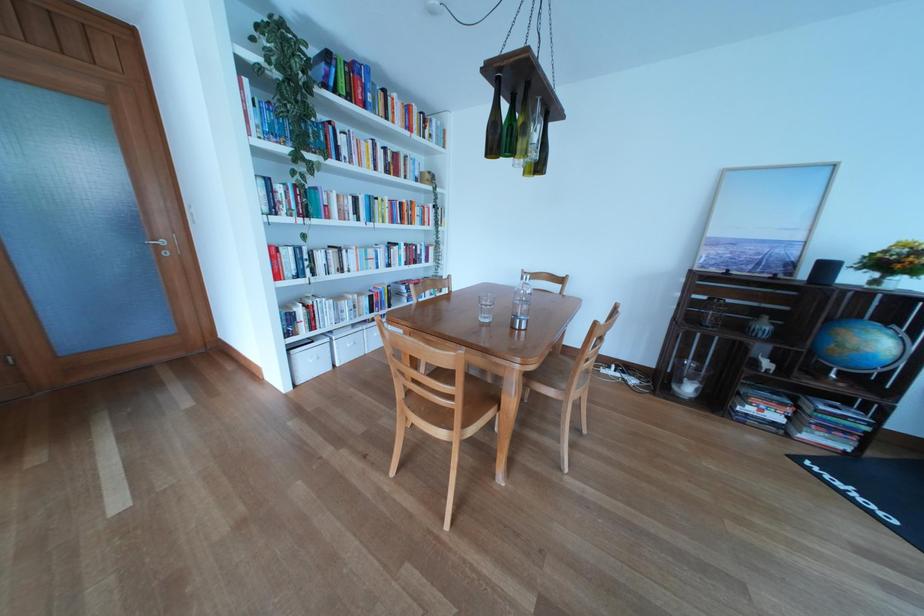
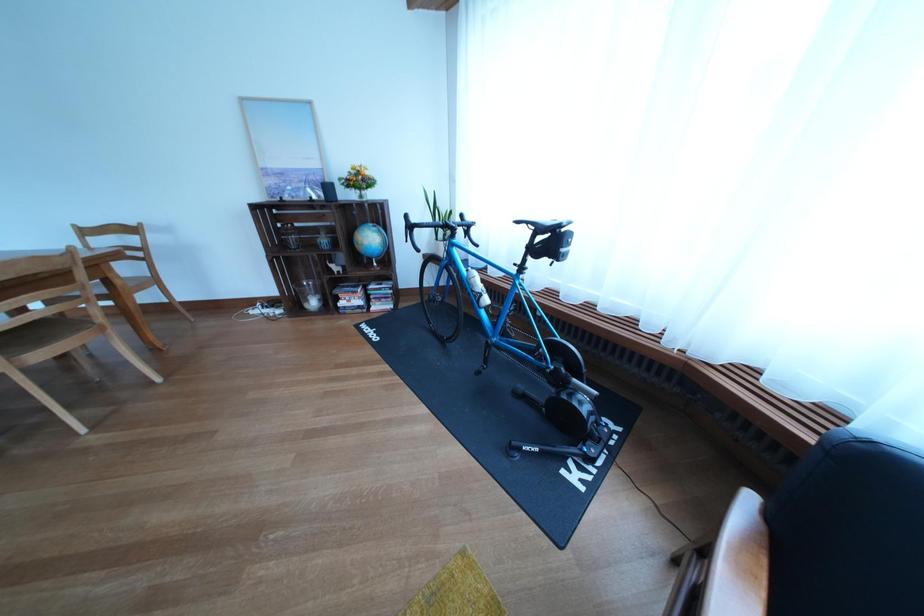
Locate, in the second image, the point that corresponds to point 694,389 in the first image.

(321, 306)